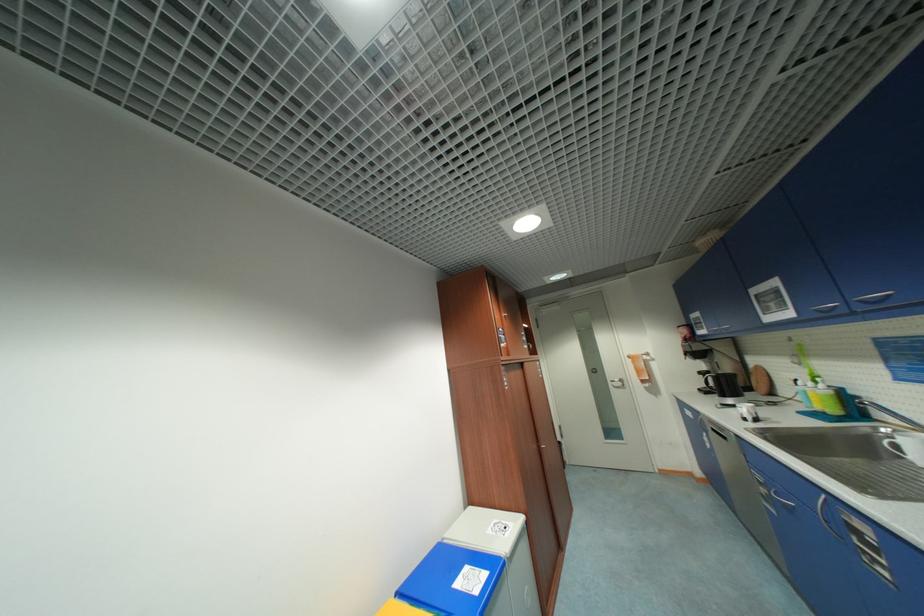
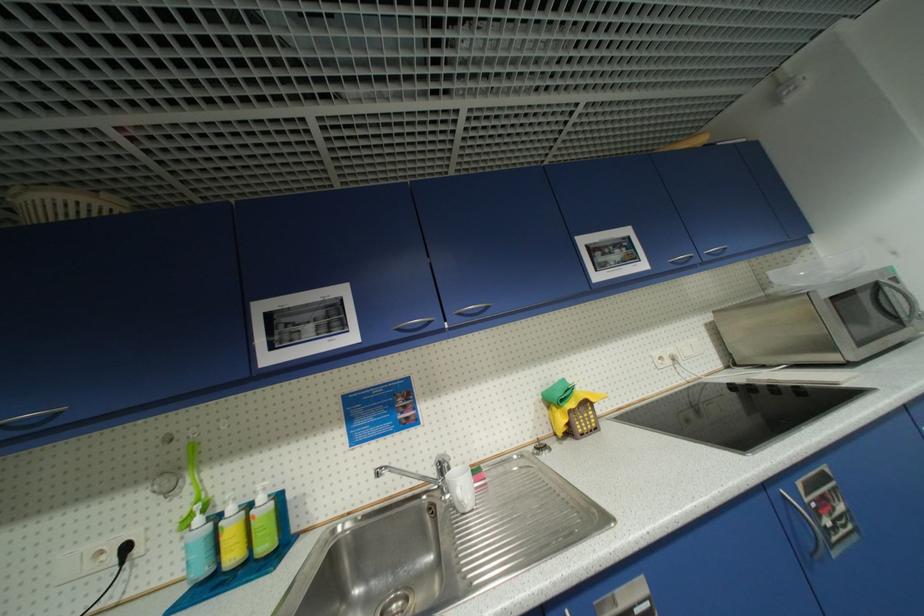
Find the pixel in the second image that matches (867,302) in the first image.

(466, 315)